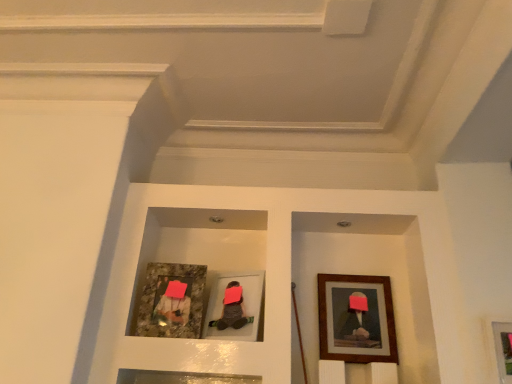
Question: From the image's perspective, would you say wooden framed picture at lower right, which is the 1th picture frame from right to left, is positioned over matte gray picture frame at center, positioned as the second picture frame in left-to-right order?

Choices:
 (A) yes
 (B) no

Answer: (B)

Question: Considering the relative sizes of wooden framed picture at lower right, the 4th picture frame from the left, and matte gray picture frame at center, positioned as the second picture frame in left-to-right order, in the image provided, is wooden framed picture at lower right, the 4th picture frame from the left, shorter than matte gray picture frame at center, positioned as the second picture frame in left-to-right order,?

Choices:
 (A) no
 (B) yes

Answer: (B)

Question: Does wooden framed picture at lower right, which is the 1th picture frame from right to left, appear on the right side of matte gray picture frame at center, positioned as the second picture frame in left-to-right order?

Choices:
 (A) yes
 (B) no

Answer: (A)

Question: Is wooden framed picture at lower right, the 4th picture frame from the left, further to the viewer compared to matte gray picture frame at center, positioned as the second picture frame in left-to-right order?

Choices:
 (A) yes
 (B) no

Answer: (B)

Question: Can you confirm if wooden framed picture at lower right, the 4th picture frame from the left, is wider than matte gray picture frame at center, the third picture frame from the right?

Choices:
 (A) no
 (B) yes

Answer: (A)

Question: From the image's perspective, is matte gray picture frame at center, positioned as the second picture frame in left-to-right order, above or below granite-like frame at left, placed as the fourth picture frame when sorted from right to left?

Choices:
 (A) below
 (B) above

Answer: (A)

Question: From a real-world perspective, is matte gray picture frame at center, the third picture frame from the right, positioned above or below granite-like frame at left, placed as the fourth picture frame when sorted from right to left?

Choices:
 (A) below
 (B) above

Answer: (A)

Question: Looking at their shapes, would you say matte gray picture frame at center, positioned as the second picture frame in left-to-right order, is wider or thinner than granite-like frame at left, placed as the fourth picture frame when sorted from right to left?

Choices:
 (A) wide
 (B) thin

Answer: (A)

Question: From their relative heights in the image, would you say matte gray picture frame at center, the third picture frame from the right, is taller or shorter than granite-like frame at left, placed as the fourth picture frame when sorted from right to left?

Choices:
 (A) short
 (B) tall

Answer: (A)

Question: Is matte gray picture frame at center, positioned as the second picture frame in left-to-right order, taller or shorter than wooden framed picture at lower right, which is the 1th picture frame from right to left?

Choices:
 (A) tall
 (B) short

Answer: (A)

Question: Considering their positions, is matte gray picture frame at center, the third picture frame from the right, located in front of or behind wooden framed picture at lower right, the 4th picture frame from the left?

Choices:
 (A) front
 (B) behind

Answer: (B)

Question: From the image's perspective, is matte gray picture frame at center, positioned as the second picture frame in left-to-right order, above or below wooden framed picture at lower right, the 4th picture frame from the left?

Choices:
 (A) below
 (B) above

Answer: (B)

Question: Do you think matte gray picture frame at center, positioned as the second picture frame in left-to-right order, is within wooden framed picture at lower right, which is the 1th picture frame from right to left, or outside of it?

Choices:
 (A) inside
 (B) outside

Answer: (B)

Question: From the image's perspective, is matte gray picture frame at center, the third picture frame from the right, above or below wooden framed artwork at right, the 3th picture frame in the left-to-right sequence?

Choices:
 (A) below
 (B) above

Answer: (B)

Question: Is matte gray picture frame at center, the third picture frame from the right, in front of or behind wooden framed artwork at right, the 3th picture frame in the left-to-right sequence, in the image?

Choices:
 (A) front
 (B) behind

Answer: (A)